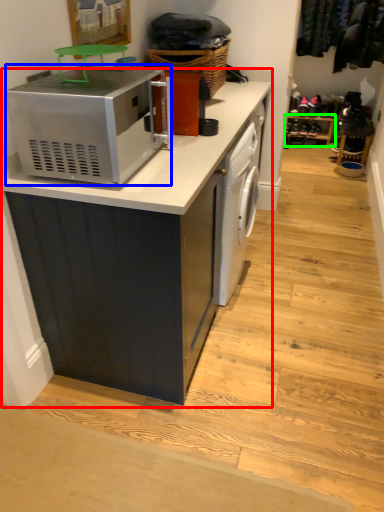
Question: Based on their relative distances, which object is farther from cabinetry (highlighted by a red box)? Choose from home appliance (highlighted by a blue box) and shelf (highlighted by a green box).

Choices:
 (A) home appliance
 (B) shelf

Answer: (B)